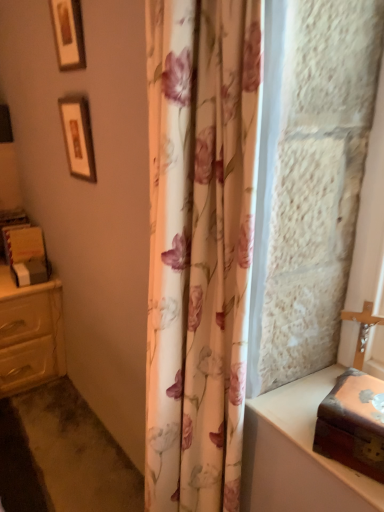
Question: Should I look upward or downward to see wooden box at right?

Choices:
 (A) down
 (B) up

Answer: (A)

Question: Is wooden box at right facing towards wooden box at right?

Choices:
 (A) yes
 (B) no

Answer: (B)

Question: Is wooden box at right to the right of wooden box at right from the viewer's perspective?

Choices:
 (A) no
 (B) yes

Answer: (A)

Question: Does wooden box at right contain wooden box at right?

Choices:
 (A) yes
 (B) no

Answer: (B)

Question: Can we say wooden box at right lies outside wooden box at right?

Choices:
 (A) no
 (B) yes

Answer: (B)

Question: Does wooden box at right have a greater width compared to wooden box at right?

Choices:
 (A) no
 (B) yes

Answer: (B)

Question: Does wooden box at right lie behind wooden box at right?

Choices:
 (A) no
 (B) yes

Answer: (B)

Question: Does wooden framed picture at upper left, marked as the 1th picture frame in a bottom-to-top arrangement, lie behind wooden box at right?

Choices:
 (A) yes
 (B) no

Answer: (A)

Question: Is wooden box at right completely or partially inside wooden framed picture at upper left, the second picture frame in the top-to-bottom sequence?

Choices:
 (A) yes
 (B) no

Answer: (B)

Question: Considering the relative sizes of wooden framed picture at upper left, the second picture frame in the top-to-bottom sequence, and wooden box at right in the image provided, is wooden framed picture at upper left, the second picture frame in the top-to-bottom sequence, smaller than wooden box at right?

Choices:
 (A) no
 (B) yes

Answer: (A)

Question: Considering the relative positions of wooden framed picture at upper left, the second picture frame in the top-to-bottom sequence, and wooden box at right in the image provided, is wooden framed picture at upper left, the second picture frame in the top-to-bottom sequence, to the left of wooden box at right from the viewer's perspective?

Choices:
 (A) yes
 (B) no

Answer: (A)

Question: Is wooden box at right at the back of wooden framed picture at upper left, marked as the 1th picture frame in a bottom-to-top arrangement?

Choices:
 (A) yes
 (B) no

Answer: (B)

Question: From a real-world perspective, is wooden framed picture at upper left, the second picture frame in the top-to-bottom sequence, over wooden box at right?

Choices:
 (A) no
 (B) yes

Answer: (B)

Question: Is floral fabric shower curtain at center to the left of matte cream chest of drawers at left from the viewer's perspective?

Choices:
 (A) yes
 (B) no

Answer: (B)